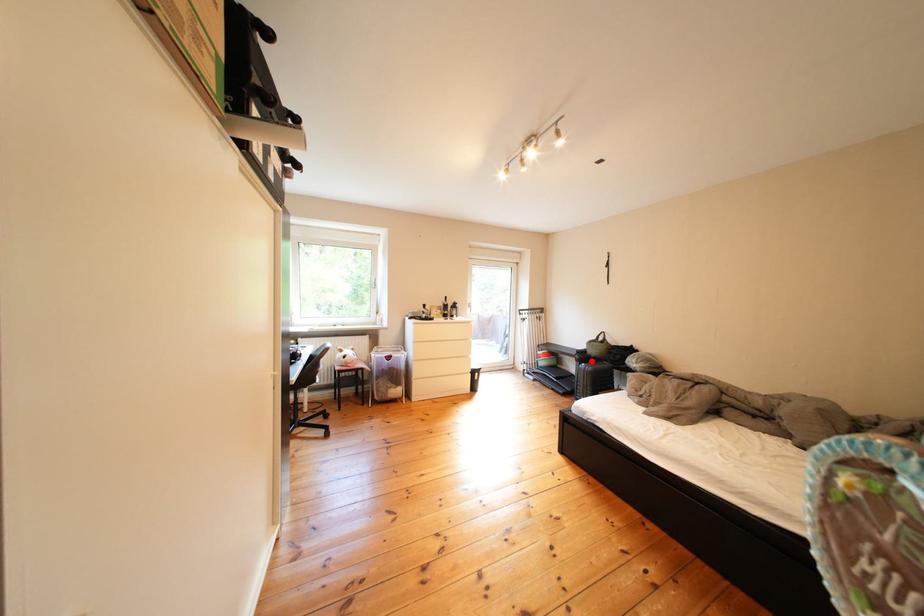
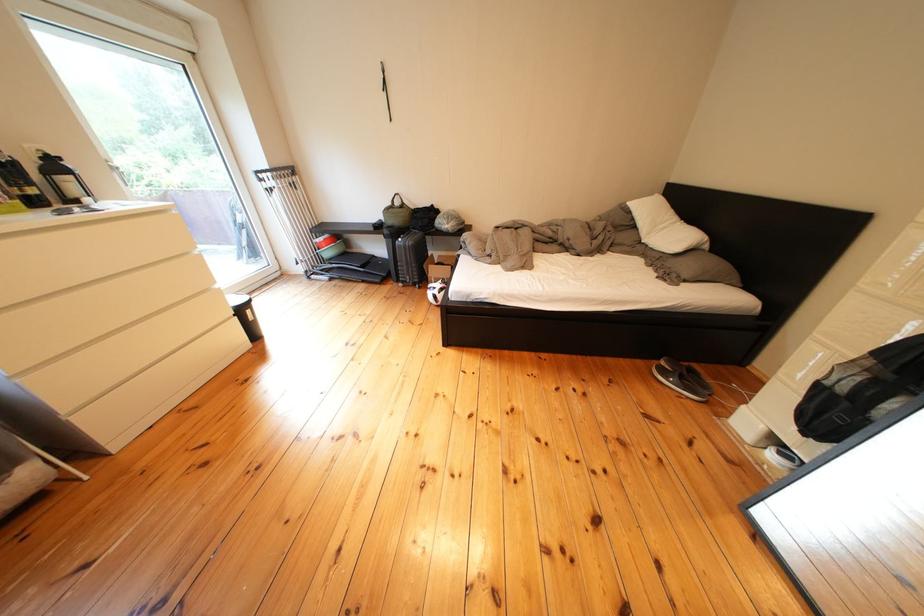
Question: I am providing you with two images of the same scene from different viewpoints. A red point is marked on the first image. At the location where the point appears in image 1, is it still visible in image 2?

Choices:
 (A) Yes
 (B) No

Answer: (A)